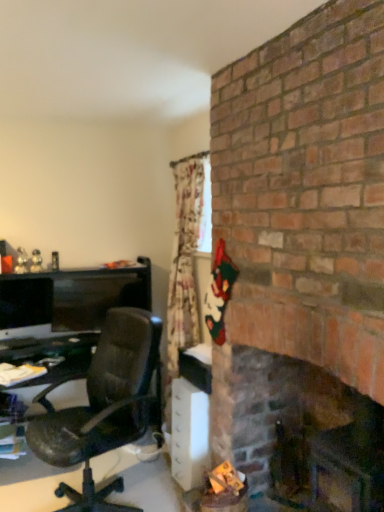
Question: From the image's perspective, is dark brown wood fireplace at right on matte black monitor at left?

Choices:
 (A) yes
 (B) no

Answer: (B)

Question: Considering the relative sizes of dark brown wood fireplace at right and matte black monitor at left in the image provided, is dark brown wood fireplace at right wider than matte black monitor at left?

Choices:
 (A) no
 (B) yes

Answer: (B)

Question: From a real-world perspective, is dark brown wood fireplace at right over matte black monitor at left?

Choices:
 (A) yes
 (B) no

Answer: (B)

Question: Considering the relative positions of dark brown wood fireplace at right and matte black monitor at left in the image provided, is dark brown wood fireplace at right behind matte black monitor at left?

Choices:
 (A) no
 (B) yes

Answer: (A)

Question: Can you confirm if dark brown wood fireplace at right is smaller than matte black monitor at left?

Choices:
 (A) yes
 (B) no

Answer: (B)

Question: Is matte black monitor at left situated inside white plastic/file cabinet at lower center or outside?

Choices:
 (A) inside
 (B) outside

Answer: (B)

Question: From a real-world perspective, is matte black monitor at left above or below white plastic/file cabinet at lower center?

Choices:
 (A) above
 (B) below

Answer: (A)

Question: Considering the positions of matte black monitor at left and white plastic/file cabinet at lower center in the image, is matte black monitor at left taller or shorter than white plastic/file cabinet at lower center?

Choices:
 (A) tall
 (B) short

Answer: (B)

Question: Is point (3, 321) closer or farther from the camera than point (175, 394)?

Choices:
 (A) farther
 (B) closer

Answer: (A)

Question: From the image's perspective, is dark brown wood fireplace at right positioned above or below matte black monitor at left?

Choices:
 (A) below
 (B) above

Answer: (A)

Question: Is dark brown wood fireplace at right inside or outside of matte black monitor at left?

Choices:
 (A) outside
 (B) inside

Answer: (A)

Question: Is dark brown wood fireplace at right bigger or smaller than matte black monitor at left?

Choices:
 (A) big
 (B) small

Answer: (A)

Question: From a real-world perspective, is dark brown wood fireplace at right physically located above or below matte black monitor at left?

Choices:
 (A) above
 (B) below

Answer: (B)

Question: From a real-world perspective, is white plastic/file cabinet at lower center positioned above or below matte black monitor at left?

Choices:
 (A) above
 (B) below

Answer: (B)

Question: Is white plastic/file cabinet at lower center inside the boundaries of matte black monitor at left, or outside?

Choices:
 (A) inside
 (B) outside

Answer: (B)